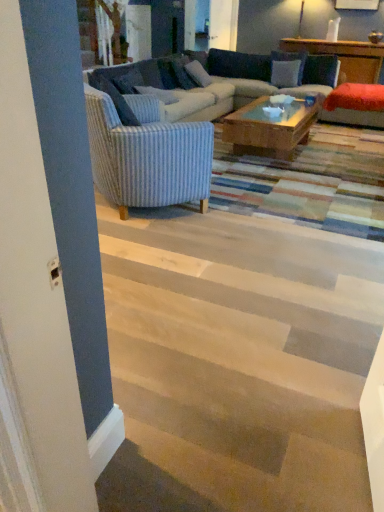
The image size is (384, 512). What are the coordinates of `suede-like blue pillow at upper center, marked as the fourth pillow in a left-to-right arrangement` in the screenshot? It's located at (285, 73).

Image resolution: width=384 pixels, height=512 pixels. In order to click on blue striped pillow at center, the 2th pillow in the left-to-right sequence in this screenshot , I will do point(158,94).

In order to face wooden stairs at lower center, should I rotate leftwards or rightwards?

Rotate left and turn 2.100 degrees.

The height and width of the screenshot is (512, 384). Find the location of `striped fabric couch at center`. striped fabric couch at center is located at coordinates (175, 103).

You are a GUI agent. You are given a task and a screenshot of the screen. Output one action in this format:
    pyautogui.click(x=<x>, y=<y>)
    Task: Click on the suede-like blue pillow at upper center, the first pillow in the right-to-left sequence
    
    Given the screenshot: What is the action you would take?
    pyautogui.click(x=285, y=73)

How different are the orientations of white fabric pillow at upper center, marked as the third pillow in a left-to-right arrangement, and blue striped pillow at upper left, marked as the fourth pillow in a right-to-left arrangement, in degrees?

The facing directions of white fabric pillow at upper center, marked as the third pillow in a left-to-right arrangement, and blue striped pillow at upper left, marked as the fourth pillow in a right-to-left arrangement, are 2.38 degrees apart.

Locate an element on the screen. This screenshot has width=384, height=512. pillow that is the 2nd object to the left of the white fabric pillow at upper center, marked as the third pillow in a left-to-right arrangement, starting at the anchor is located at coordinates (128, 81).

How much distance is there between white fabric pillow at upper center, the 2th pillow viewed from the right, and blue striped pillow at upper left, placed as the first pillow when sorted from left to right?

white fabric pillow at upper center, the 2th pillow viewed from the right, and blue striped pillow at upper left, placed as the first pillow when sorted from left to right, are 6.89 feet apart from each other.

Between white fabric pillow at upper center, marked as the third pillow in a left-to-right arrangement, and blue striped pillow at upper left, marked as the fourth pillow in a right-to-left arrangement, which one has more height?

With more height is white fabric pillow at upper center, marked as the third pillow in a left-to-right arrangement.

In the scene shown: Is wooden stairs at lower center in front of or behind striped fabric couch at center in the image?

wooden stairs at lower center is in front of striped fabric couch at center.

Which of these two, wooden stairs at lower center or striped fabric couch at center, is wider?

wooden stairs at lower center is wider.

Where is `studio couch behind the wooden stairs at lower center`? Image resolution: width=384 pixels, height=512 pixels. studio couch behind the wooden stairs at lower center is located at coordinates (175, 103).

Is striped fabric couch at center wider than white fabric pillow at upper center, marked as the third pillow in a left-to-right arrangement?

Yes.

Which of these two, striped fabric couch at center or white fabric pillow at upper center, the 2th pillow viewed from the right, is bigger?

striped fabric couch at center is bigger.

Which is further, (x=121, y=66) or (x=187, y=63)?

Point (x=187, y=63)

Is striped fabric couch at center at the right side of white fabric pillow at upper center, the 2th pillow viewed from the right?

Indeed, striped fabric couch at center is positioned on the right side of white fabric pillow at upper center, the 2th pillow viewed from the right.

Who is smaller, striped fabric couch at center or blue striped pillow at center, the 2th pillow in the left-to-right sequence?

blue striped pillow at center, the 2th pillow in the left-to-right sequence, is smaller.

Relative to blue striped pillow at center, which is the third pillow from right to left, is striped fabric couch at center in front or behind?

Visually, striped fabric couch at center is located in front of blue striped pillow at center, which is the third pillow from right to left.

Between striped fabric couch at center and blue striped pillow at center, which is the third pillow from right to left, which one has smaller width?

blue striped pillow at center, which is the third pillow from right to left, is thinner.

Who is taller, striped fabric couch at center or blue striped pillow at center, which is the third pillow from right to left?

Standing taller between the two is striped fabric couch at center.

What's the angular difference between blue striped pillow at upper left, marked as the fourth pillow in a right-to-left arrangement, and blue striped pillow at center, which is the third pillow from right to left,'s facing directions?

0.000276 degrees separate the facing orientations of blue striped pillow at upper left, marked as the fourth pillow in a right-to-left arrangement, and blue striped pillow at center, which is the third pillow from right to left.

Which of these two, blue striped pillow at upper left, marked as the fourth pillow in a right-to-left arrangement, or blue striped pillow at center, the 2th pillow in the left-to-right sequence, is bigger?

blue striped pillow at upper left, marked as the fourth pillow in a right-to-left arrangement, is bigger.

Considering their positions, is blue striped pillow at upper left, marked as the fourth pillow in a right-to-left arrangement, located in front of or behind blue striped pillow at center, which is the third pillow from right to left?

blue striped pillow at upper left, marked as the fourth pillow in a right-to-left arrangement, is positioned closer to the viewer than blue striped pillow at center, which is the third pillow from right to left.

Which is more to the right, blue striped pillow at upper left, marked as the fourth pillow in a right-to-left arrangement, or blue striped pillow at center, which is the third pillow from right to left?

From the viewer's perspective, blue striped pillow at center, which is the third pillow from right to left, appears more on the right side.

Does white fabric pillow at upper center, the 2th pillow viewed from the right, lie in front of striped fabric couch at center?

No, white fabric pillow at upper center, the 2th pillow viewed from the right, is further to the viewer.

Which is more distant, (210, 79) or (97, 176)?

The point (210, 79) is behind.

From the image's perspective, is white fabric pillow at upper center, the 2th pillow viewed from the right, below striped fabric couch at center?

No, from the image's perspective, white fabric pillow at upper center, the 2th pillow viewed from the right, is not below striped fabric couch at center.

Are white fabric pillow at upper center, marked as the third pillow in a left-to-right arrangement, and striped fabric couch at center beside each other?

They are not placed beside each other.

Which is more to the right, white fabric pillow at upper center, the 2th pillow viewed from the right, or wooden stairs at lower center?

Positioned to the right is white fabric pillow at upper center, the 2th pillow viewed from the right.

Is white fabric pillow at upper center, marked as the third pillow in a left-to-right arrangement, directly adjacent to wooden stairs at lower center?

No, white fabric pillow at upper center, marked as the third pillow in a left-to-right arrangement, is not next to wooden stairs at lower center.

Between white fabric pillow at upper center, the 2th pillow viewed from the right, and wooden stairs at lower center, which one has less height?

wooden stairs at lower center.

From the image's perspective, starting from the blue striped pillow at upper left, marked as the fourth pillow in a right-to-left arrangement, which pillow is the 1st one above? Please provide its 2D coordinates.

[(198, 73)]

Find the location of a particular element. stairwell lying on the left of striped fabric couch at center is located at coordinates [237, 362].

Which object lies further to the anchor point striped fabric couch at center, blue striped pillow at upper left, marked as the fourth pillow in a right-to-left arrangement, or wooden stairs at lower center?

wooden stairs at lower center lies further to striped fabric couch at center than the other object.

Estimate the real-world distances between objects in this image. Which object is further from striped fabric couch at center, wooden stairs at lower center or blue striped pillow at center, the 2th pillow in the left-to-right sequence?

wooden stairs at lower center is further to striped fabric couch at center.

Considering their positions, is blue striped pillow at upper left, marked as the fourth pillow in a right-to-left arrangement, positioned further to white fabric pillow at upper center, the 2th pillow viewed from the right, than striped fabric couch at center?

The object further to white fabric pillow at upper center, the 2th pillow viewed from the right, is blue striped pillow at upper left, marked as the fourth pillow in a right-to-left arrangement.

From the image, which object appears to be farther from blue striped pillow at center, which is the third pillow from right to left, blue striped pillow at upper left, marked as the fourth pillow in a right-to-left arrangement, or striped fabric couch at center?

blue striped pillow at upper left, marked as the fourth pillow in a right-to-left arrangement, is positioned further to the anchor blue striped pillow at center, which is the third pillow from right to left.

From the image, which object appears to be nearer to white fabric pillow at upper center, marked as the third pillow in a left-to-right arrangement, blue striped pillow at upper left, placed as the first pillow when sorted from left to right, or suede-like blue pillow at upper center, the first pillow in the right-to-left sequence?

Among the two, suede-like blue pillow at upper center, the first pillow in the right-to-left sequence, is located nearer to white fabric pillow at upper center, marked as the third pillow in a left-to-right arrangement.

Considering their positions, is suede-like blue pillow at upper center, the first pillow in the right-to-left sequence, positioned closer to white fabric pillow at upper center, marked as the third pillow in a left-to-right arrangement, than striped fabric couch at center?

striped fabric couch at center is positioned closer to the anchor white fabric pillow at upper center, marked as the third pillow in a left-to-right arrangement.

Estimate the real-world distances between objects in this image. Which object is closer to blue striped pillow at center, which is the third pillow from right to left, wooden stairs at lower center or suede-like blue pillow at upper center, marked as the fourth pillow in a left-to-right arrangement?

Based on the image, suede-like blue pillow at upper center, marked as the fourth pillow in a left-to-right arrangement, appears to be nearer to blue striped pillow at center, which is the third pillow from right to left.

When comparing their distances from blue striped pillow at center, which is the third pillow from right to left, does suede-like blue pillow at upper center, the first pillow in the right-to-left sequence, or white fabric pillow at upper center, marked as the third pillow in a left-to-right arrangement, seem closer?

white fabric pillow at upper center, marked as the third pillow in a left-to-right arrangement, lies closer to blue striped pillow at center, which is the third pillow from right to left, than the other object.

The image size is (384, 512). I want to click on pillow positioned between blue striped pillow at upper left, placed as the first pillow when sorted from left to right, and white fabric pillow at upper center, the 2th pillow viewed from the right, from near to far, so click(158, 94).

You are a GUI agent. You are given a task and a screenshot of the screen. Output one action in this format:
    pyautogui.click(x=<x>, y=<y>)
    Task: Click on the studio couch between wooden stairs at lower center and blue striped pillow at upper left, placed as the first pillow when sorted from left to right, in the front-back direction
    
    Given the screenshot: What is the action you would take?
    pyautogui.click(x=175, y=103)

You are a GUI agent. You are given a task and a screenshot of the screen. Output one action in this format:
    pyautogui.click(x=<x>, y=<y>)
    Task: Click on the studio couch between wooden stairs at lower center and white fabric pillow at upper center, marked as the third pillow in a left-to-right arrangement, from front to back
    This screenshot has height=512, width=384.
    Given the screenshot: What is the action you would take?
    pyautogui.click(x=175, y=103)

Image resolution: width=384 pixels, height=512 pixels. In order to click on pillow between wooden stairs at lower center and blue striped pillow at center, the 2th pillow in the left-to-right sequence, along the z-axis in this screenshot , I will do `click(128, 81)`.